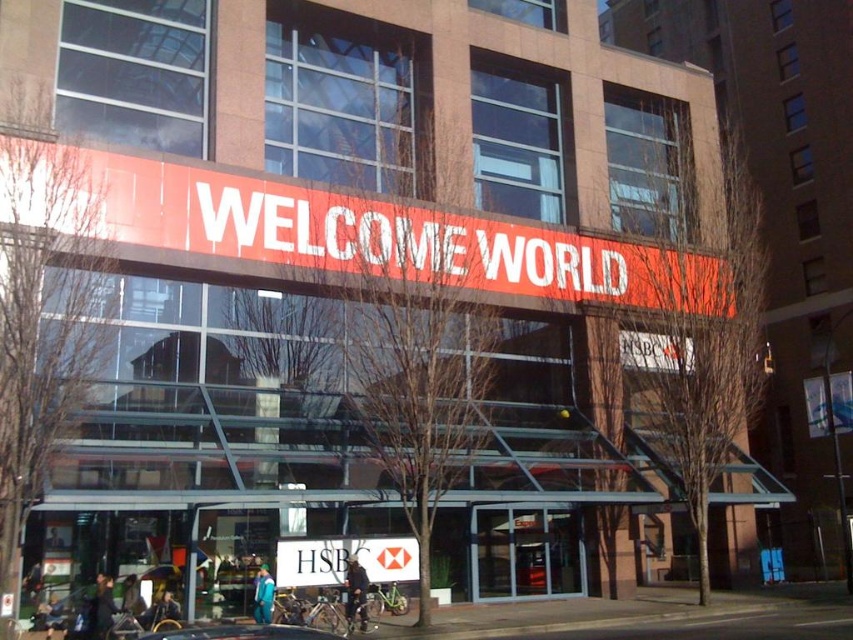
Question: Is white paper sign at center closer to camera compared to metallic silver car at lower center?

Choices:
 (A) yes
 (B) no

Answer: (B)

Question: Among these points, which one is farthest from the camera?

Choices:
 (A) (196, 625)
 (B) (326, 557)

Answer: (B)

Question: Which of the following is the closest to the observer?

Choices:
 (A) (338, 636)
 (B) (355, 548)

Answer: (A)

Question: Does white paper sign at center appear on the left side of metallic silver car at lower center?

Choices:
 (A) yes
 (B) no

Answer: (B)

Question: Does white paper sign at center have a larger size compared to metallic silver car at lower center?

Choices:
 (A) yes
 (B) no

Answer: (B)